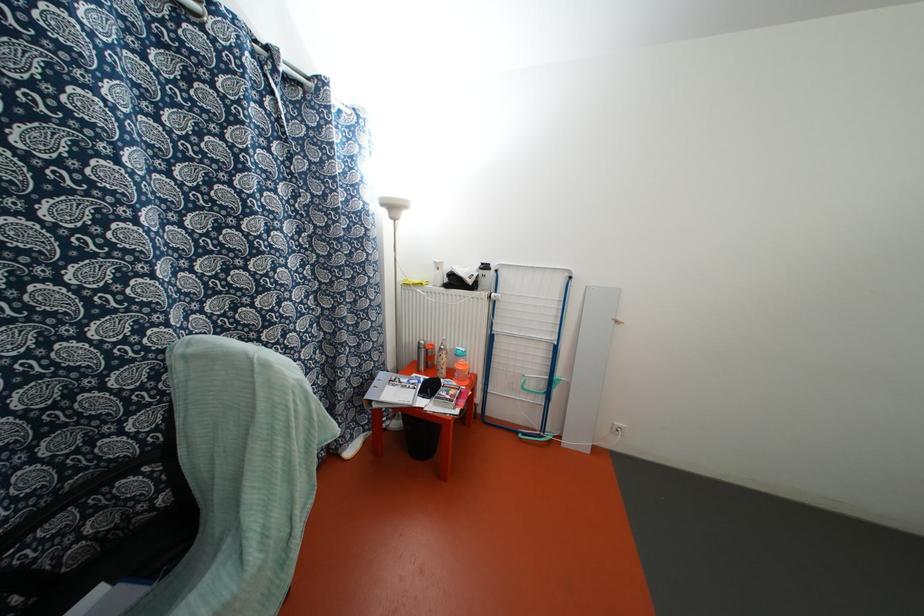
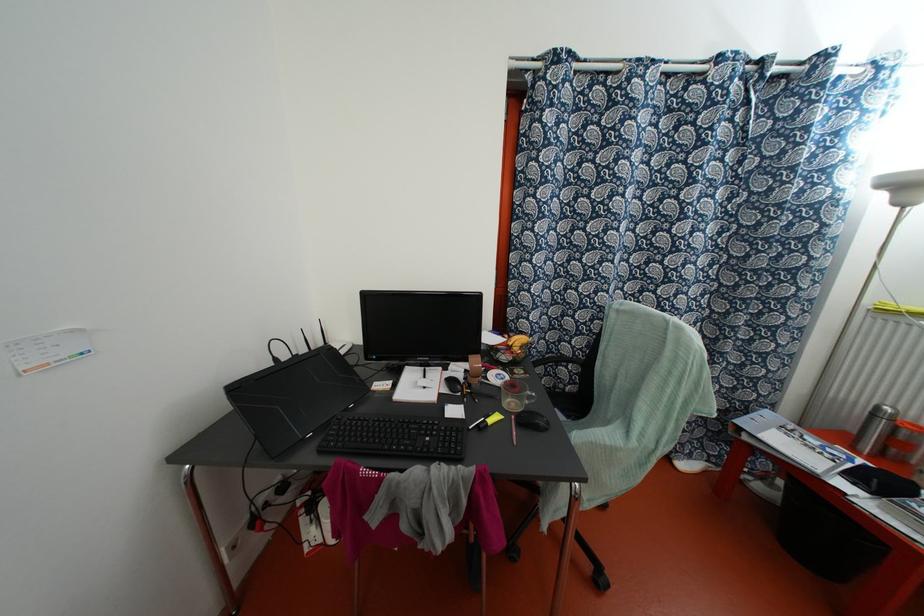
Locate, in the second image, the point that corresponds to pixel 419 347 in the first image.

(872, 415)